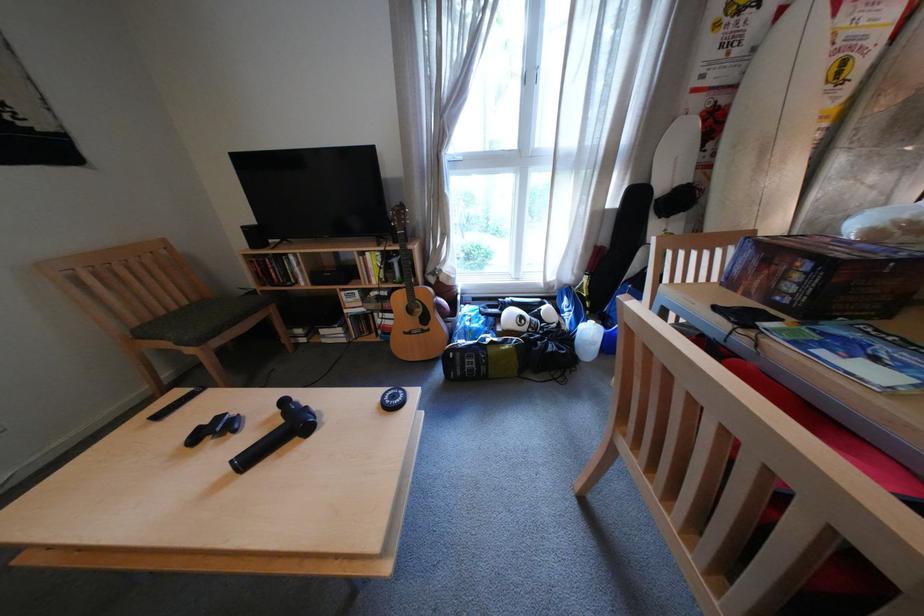
This screenshot has width=924, height=616. What are the coordinates of `black handheld massager` in the screenshot? It's located at (276, 434).